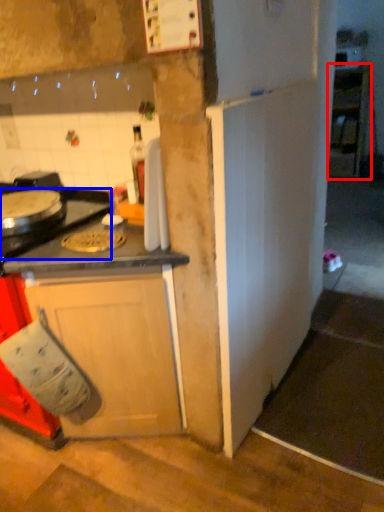
Question: Among these objects, which one is farthest to the camera, cabinetry (highlighted by a red box) or gas stove (highlighted by a blue box)?

Choices:
 (A) cabinetry
 (B) gas stove

Answer: (A)